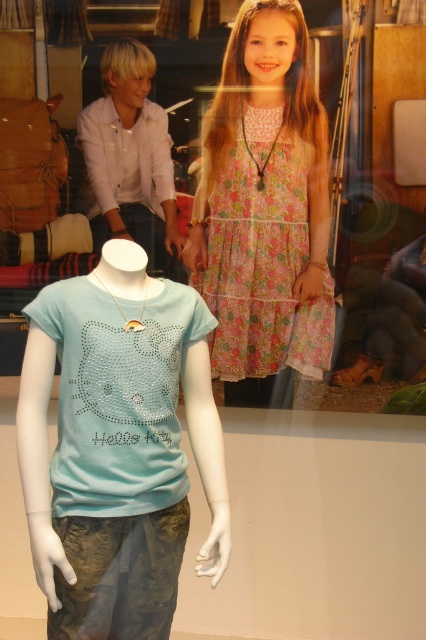
Question: Estimate the real-world distances between objects in this image. Which object is farther from the light blue fabric hello kitty shirt at center?

Choices:
 (A) light blue jersey at center
 (B) floral cotton dress at upper center

Answer: (A)

Question: Which point appears closest to the camera in this image?

Choices:
 (A) (65, 554)
 (B) (382, 291)
 (C) (247, 330)

Answer: (A)

Question: Is light blue jersey at center above floral cotton dress at upper center?

Choices:
 (A) yes
 (B) no

Answer: (A)

Question: Does light blue jersey at center have a greater width compared to light blue fabric hello kitty shirt at center?

Choices:
 (A) yes
 (B) no

Answer: (A)

Question: Among these points, which one is nearest to the camera?

Choices:
 (A) (393, 221)
 (B) (46, 344)

Answer: (B)

Question: Is the position of light blue jersey at center less distant than that of light blue fabric hello kitty shirt at center?

Choices:
 (A) yes
 (B) no

Answer: (B)